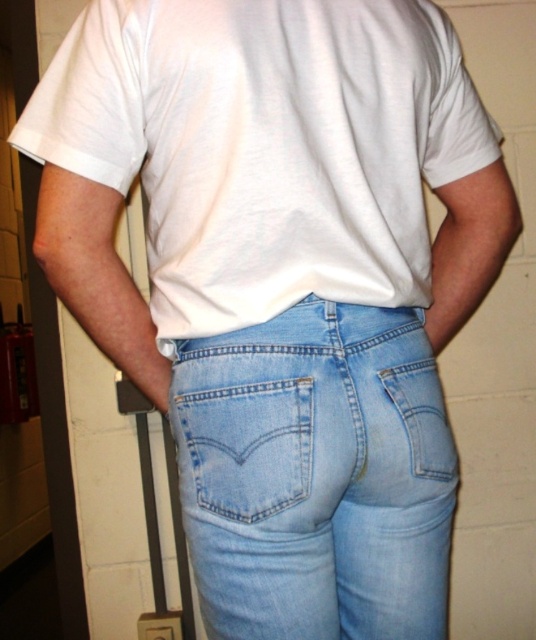
Question: Observing the image, what is the correct spatial positioning of light blue denim pocket at center in reference to light blue denim pocket at lower center?

Choices:
 (A) below
 (B) above

Answer: (A)

Question: Is light blue denim pocket at center wider than light blue denim pocket at lower center?

Choices:
 (A) yes
 (B) no

Answer: (A)

Question: Which of these objects is positioned farthest from the light blue denim pocket at lower center?

Choices:
 (A) light blue denim pocket at center
 (B) light blue denim jeans at center

Answer: (A)

Question: Which point appears farthest from the camera in this image?

Choices:
 (A) (414, 392)
 (B) (307, 541)

Answer: (A)

Question: Which point appears farthest from the camera in this image?

Choices:
 (A) (263, 340)
 (B) (277, 429)

Answer: (A)

Question: Is light blue denim jeans at center to the left of light blue denim pocket at center from the viewer's perspective?

Choices:
 (A) yes
 (B) no

Answer: (B)